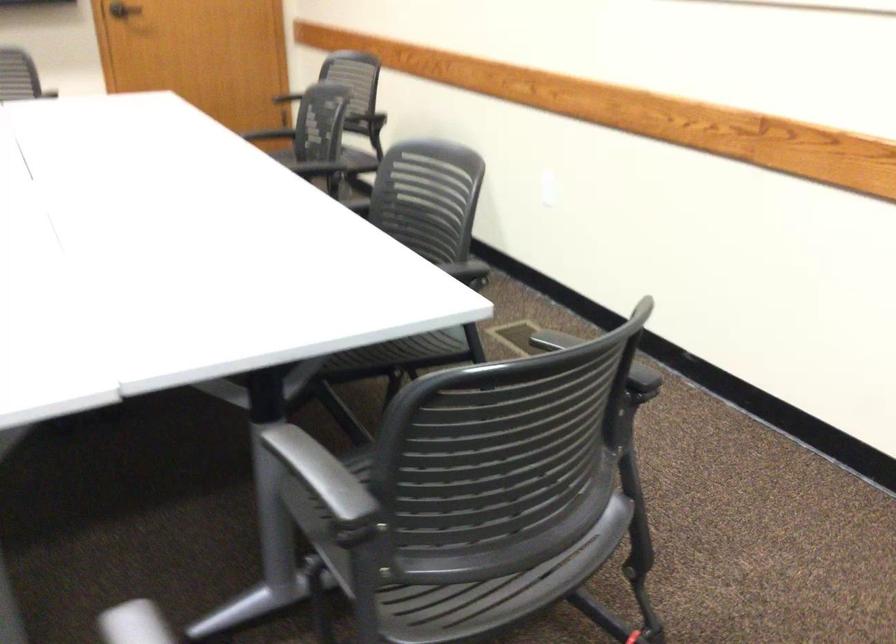
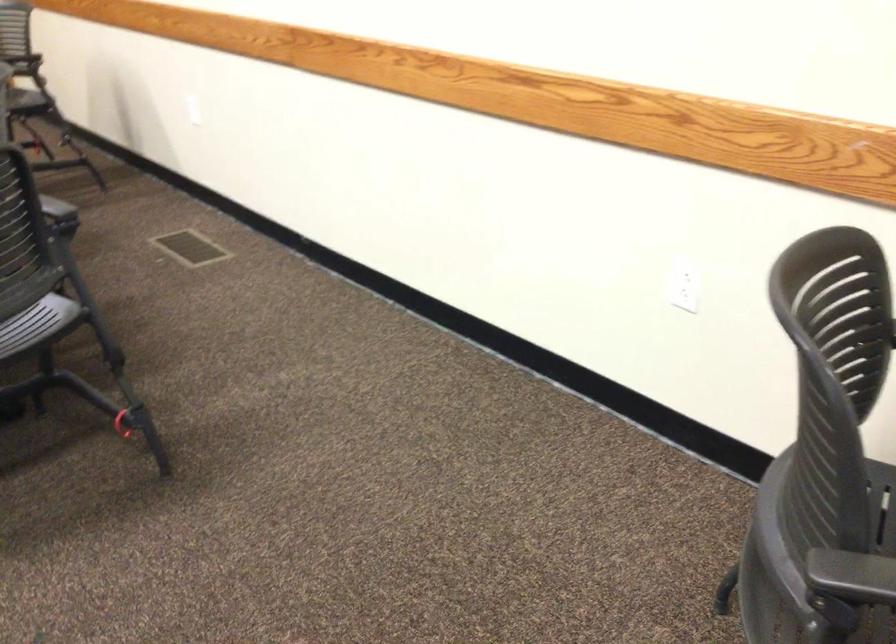
Where in the second image is the point corresponding to the point at 595,377 from the first image?

(56, 207)